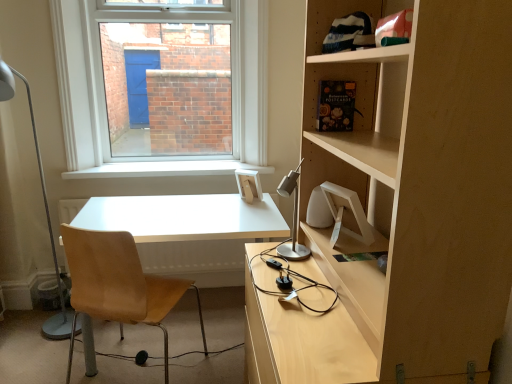
Question: Can you confirm if white metal table lamp at left, placed as the 2th table lamp when sorted from right to left, is bigger than satin silver table lamp at center, which is counted as the second table lamp, starting from the back?

Choices:
 (A) no
 (B) yes

Answer: (B)

Question: Does white metal table lamp at left, which appears as the 2th table lamp when viewed from the front, appear on the right side of satin silver table lamp at center, which ranks as the 1th table lamp in right-to-left order?

Choices:
 (A) no
 (B) yes

Answer: (A)

Question: From the image's perspective, is white metal table lamp at left, which appears as the 2th table lamp when viewed from the front, on satin silver table lamp at center, which is counted as the second table lamp, starting from the back?

Choices:
 (A) no
 (B) yes

Answer: (A)

Question: Is white metal table lamp at left, marked as the first table lamp in a left-to-right arrangement, taller than satin silver table lamp at center, which is counted as the second table lamp, starting from the back?

Choices:
 (A) no
 (B) yes

Answer: (B)

Question: Is white metal table lamp at left, marked as the first table lamp in a left-to-right arrangement, positioned before satin silver table lamp at center, which ranks as the 1th table lamp in right-to-left order?

Choices:
 (A) yes
 (B) no

Answer: (B)

Question: Is white metal table lamp at left, placed as the 2th table lamp when sorted from right to left, at the left side of satin silver table lamp at center, which is counted as the 2th table lamp, starting from the left?

Choices:
 (A) no
 (B) yes

Answer: (B)

Question: Is white matte desk at center not near satin silver table lamp at center, which ranks as the 1th table lamp in right-to-left order?

Choices:
 (A) yes
 (B) no

Answer: (B)

Question: Can you confirm if white matte desk at center is thinner than satin silver table lamp at center, which is counted as the 1th table lamp, starting from the front?

Choices:
 (A) no
 (B) yes

Answer: (A)

Question: Considering the relative sizes of white matte desk at center and satin silver table lamp at center, which ranks as the 1th table lamp in right-to-left order, in the image provided, is white matte desk at center shorter than satin silver table lamp at center, which ranks as the 1th table lamp in right-to-left order,?

Choices:
 (A) no
 (B) yes

Answer: (A)

Question: Considering the relative sizes of white matte desk at center and satin silver table lamp at center, which ranks as the 1th table lamp in right-to-left order, in the image provided, is white matte desk at center smaller than satin silver table lamp at center, which ranks as the 1th table lamp in right-to-left order,?

Choices:
 (A) no
 (B) yes

Answer: (A)

Question: Is the depth of white matte desk at center greater than that of satin silver table lamp at center, which is counted as the 2th table lamp, starting from the left?

Choices:
 (A) yes
 (B) no

Answer: (A)

Question: Considering the relative sizes of white matte desk at center and satin silver table lamp at center, which is counted as the 2th table lamp, starting from the left, in the image provided, is white matte desk at center wider than satin silver table lamp at center, which is counted as the 2th table lamp, starting from the left,?

Choices:
 (A) no
 (B) yes

Answer: (B)

Question: Considering the relative positions of light brown leather chair at left and white metal table lamp at left, which is the first table lamp from back to front, in the image provided, is light brown leather chair at left behind white metal table lamp at left, which is the first table lamp from back to front,?

Choices:
 (A) no
 (B) yes

Answer: (A)